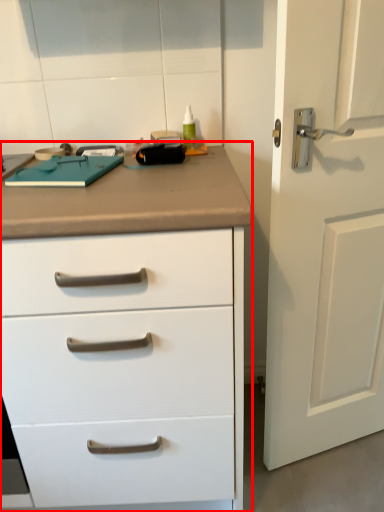
Question: From the image's perspective, what is the correct spatial positioning of chest of drawers (annotated by the red box) in reference to door?

Choices:
 (A) below
 (B) above

Answer: (A)